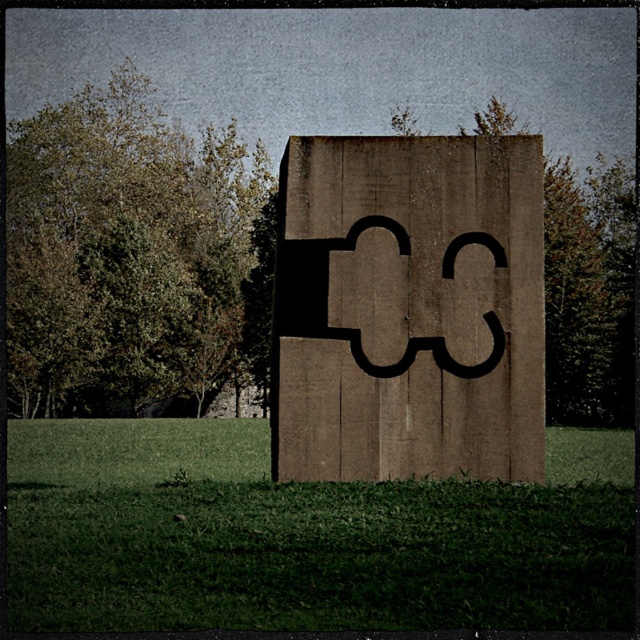
You are standing at the entrance of the park and want to locate the brown concrete sign at center. Based on its coordinates, where should you look relative to the trees in the background?

The brown concrete sign at center is positioned at coordinates point (x=410, y=308), which places it near the center of the image, closer to the bottom than the top. Since the background has a line of trees, the sign is likely in the foreground between you and the trees.

From the picture: You are standing in the park and see the green grass at center and the brown concrete sign at center. Which object is located below the other?

The green grass at center is positioned under the brown concrete sign at center, so the grass is below the sign.

You are standing in a park and see the green grass at center and the brown concrete sign at center. Which object is located to the right when facing the scene?

The green grass at center is to the right of the brown concrete sign at center, so when facing the scene, the green grass at center is on the right side.